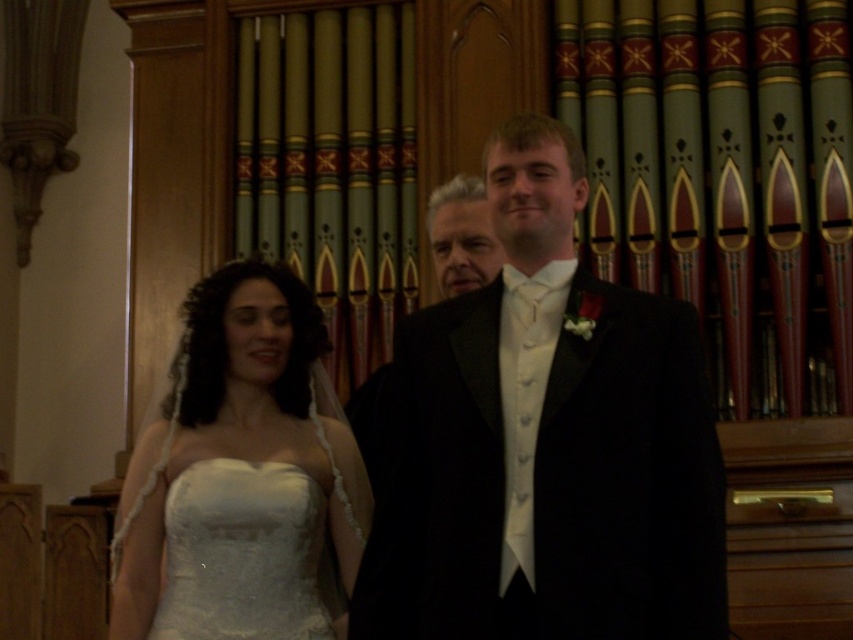
Looking at this image, you are a photographer at a wedding. You need to position the velvet black suit at center and the white satin dress at lower left in your shot. Which one is taller so you can adjust the camera angle accordingly?

The velvet black suit at center is taller than the white satin dress at lower left, so you should adjust the camera angle to account for its height.

You are a photographer at the event and want to focus on the two points in the image. Which point, point (416, 321) or point (273, 467), is closer to your camera?

Point (416, 321) is closer to the camera than point (273, 467).

In the scene shown: You are a photographer at a wedding. You need to position yourself so that the white satin dress at center and the white satin dress at lower left are both in frame. According to the scene, which dress is positioned to the left of the other?

The white satin dress at center is to the left of the white satin dress at lower left.